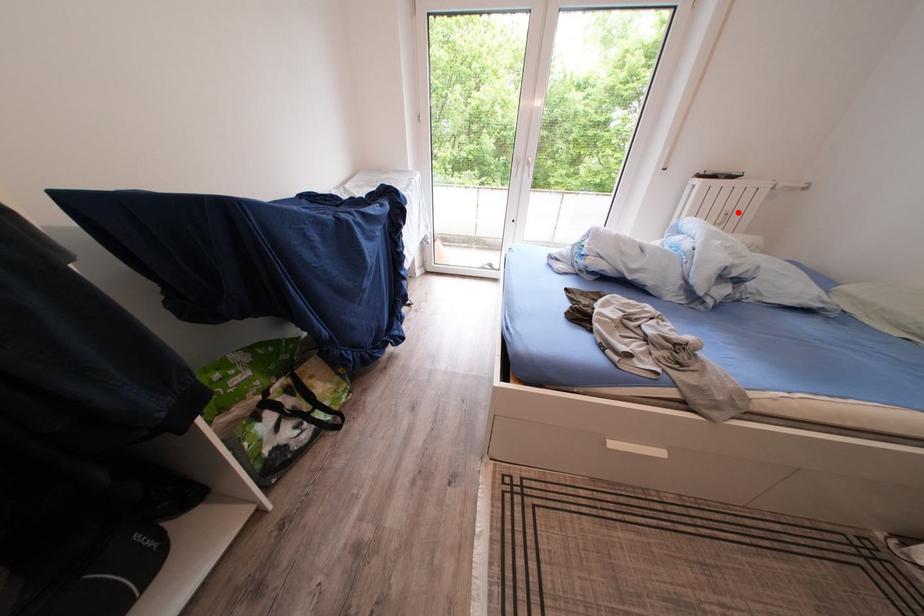
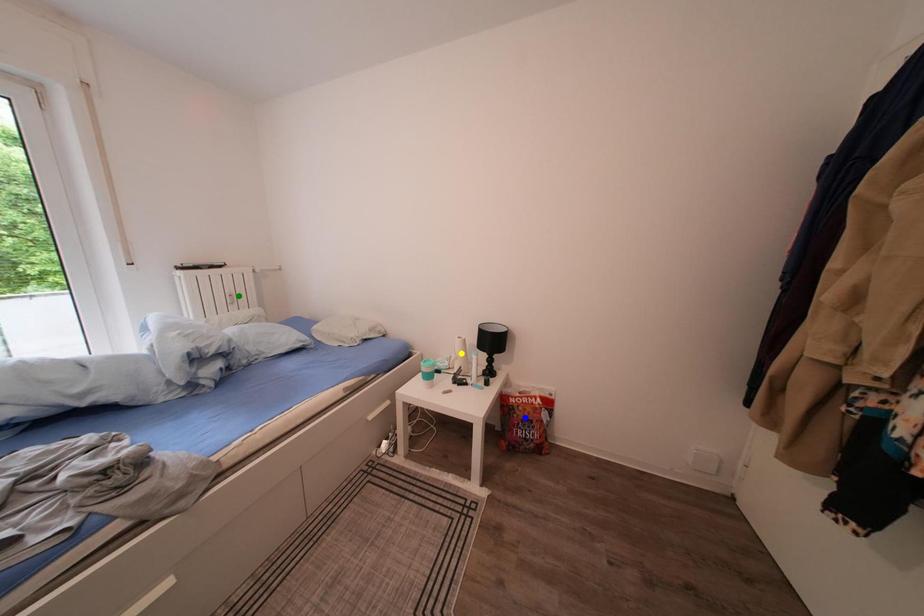
Question: I am providing you with two images of the same scene from different viewpoints. A red point is marked on the first image. You are given multiple points on the second image. Can you choose the point in image 2 that corresponds to the point in image 1?

Choices:
 (A) green point
 (B) yellow point
 (C) blue point

Answer: (A)